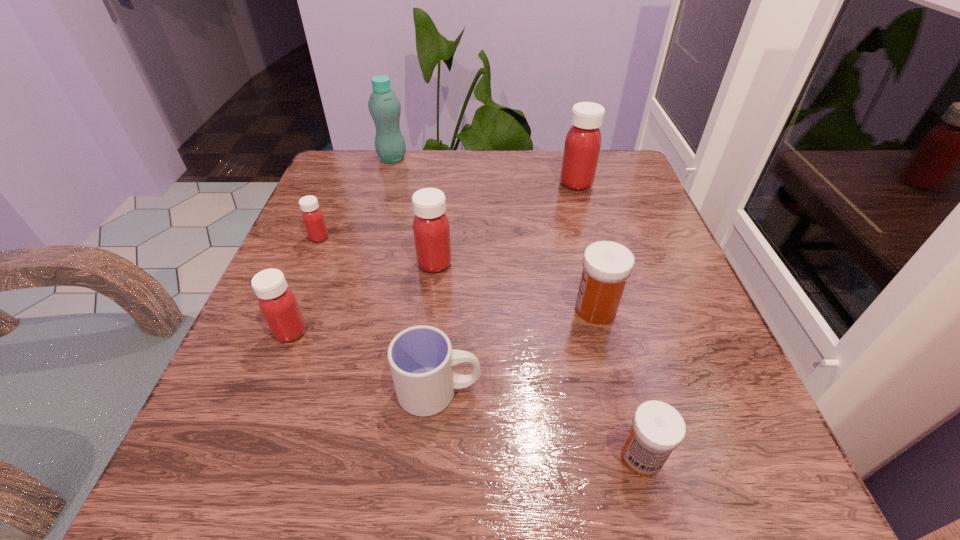
At what (x,y) coordinates should I click in order to perform the action: click on vacant area in the image that satisfies the following two spatial constraints: 1. on the back side of the seventh nearest object; 2. at the front cap of the water bottle. Please return your answer as a coordinate pair (x, y). Looking at the image, I should click on (569, 159).

Locate an element on the screen. free space that satisfies the following two spatial constraints: 1. on the front side of the bigger white medicine; 2. on the left side of the nearest object is located at coordinates (633, 457).

Identify the location of vacant space that satisfies the following two spatial constraints: 1. at the front cap of the third object from left to right; 2. on the back side of the farther white medicine. (349, 309).